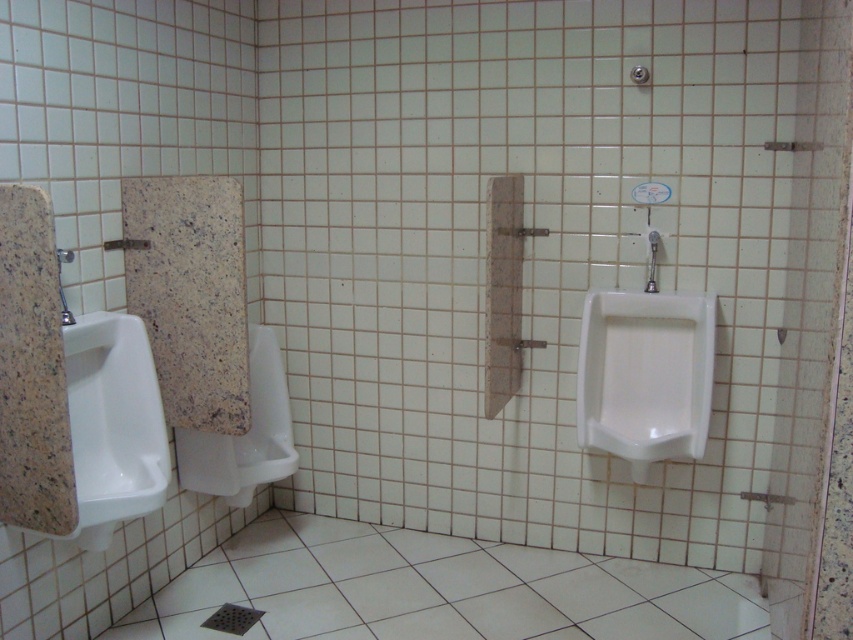
Question: Considering the real-world distances, which object is farthest from the white glossy urinal at left?

Choices:
 (A) white glossy urinal at center
 (B) white glossy urinal at right

Answer: (B)

Question: Which of the following is the farthest from the observer?

Choices:
 (A) white glossy urinal at center
 (B) white glossy urinal at left
 (C) white glossy urinal at right

Answer: (A)

Question: Can you confirm if white glossy urinal at right is positioned above white glossy urinal at left?

Choices:
 (A) no
 (B) yes

Answer: (B)

Question: Is white glossy urinal at right above white glossy urinal at center?

Choices:
 (A) yes
 (B) no

Answer: (A)

Question: Which object appears closest to the camera in this image?

Choices:
 (A) white glossy urinal at center
 (B) white glossy urinal at right
 (C) white glossy urinal at left

Answer: (C)

Question: Where is white glossy urinal at right located in relation to white glossy urinal at left in the image?

Choices:
 (A) below
 (B) above

Answer: (B)